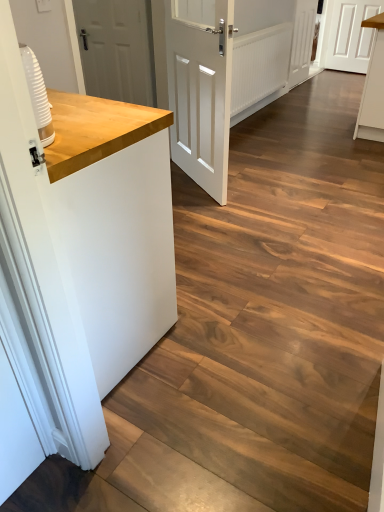
Question: From the image's perspective, is white matte cabinet at upper right located above or below white matte door at upper left, which is the second door from front to back?

Choices:
 (A) above
 (B) below

Answer: (A)

Question: From a real-world perspective, is white matte cabinet at upper right positioned above or below white matte door at upper left, which is the 4th door in right-to-left order?

Choices:
 (A) above
 (B) below

Answer: (B)

Question: Which object is the farthest from the wooden countertop at left?

Choices:
 (A) white wooden door at upper center, the second door from the back
 (B) white wooden door at upper right, the first door from the back
 (C) white matte door at center, which appears as the 3th door when viewed from the right
 (D) white matte door at upper left, placed as the first door when sorted from left to right
 (E) white matte cabinet at upper right

Answer: (B)

Question: Considering the real-world distances, which object is farthest from the white matte door at center, the fourth door viewed from the back?

Choices:
 (A) white matte door at upper left, the 3th door in the back-to-front sequence
 (B) white wooden door at upper center, which is the third door from left to right
 (C) wooden countertop at left
 (D) white wooden door at upper right, positioned as the 1th door in right-to-left order
 (E) white matte cabinet at upper right

Answer: (D)